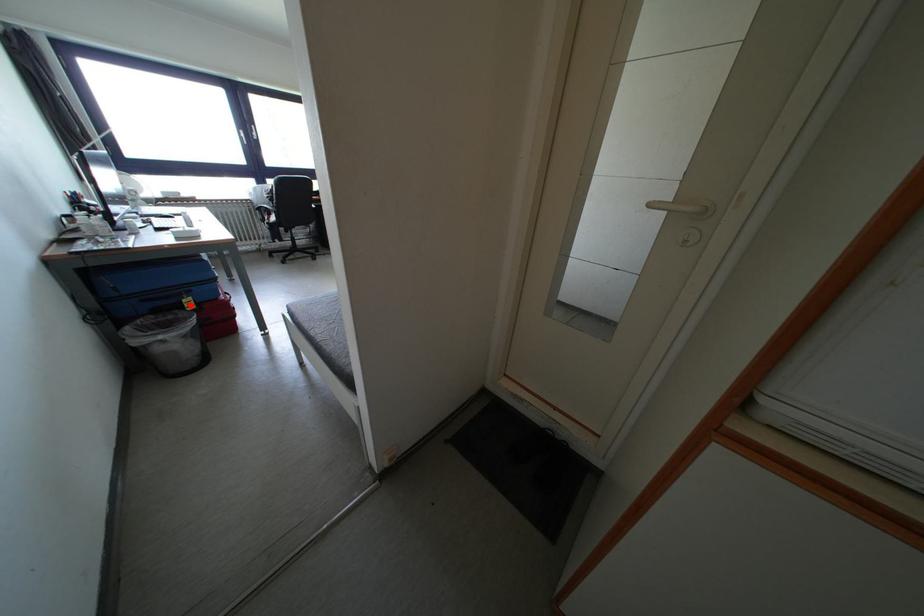
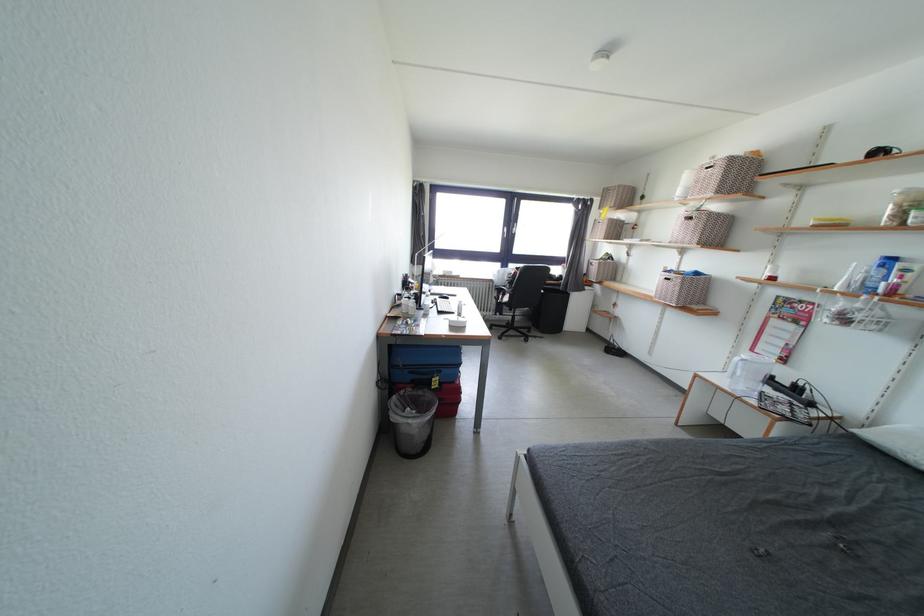
The point at the highlighted location is marked in the first image. Where is the corresponding point in the second image?

(440, 384)